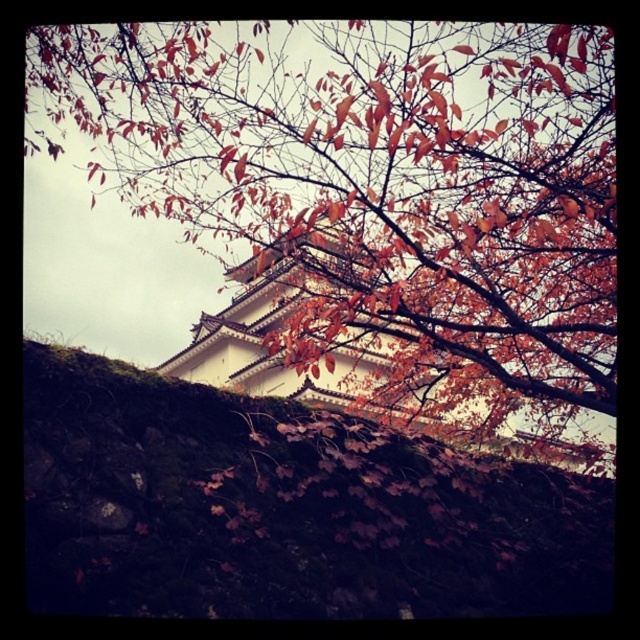
Question: Does autumn leaves at upper center have a greater width compared to mossy stone wall at lower center?

Choices:
 (A) yes
 (B) no

Answer: (A)

Question: Can you confirm if autumn leaves at upper center is smaller than mossy stone wall at lower center?

Choices:
 (A) no
 (B) yes

Answer: (A)

Question: Is autumn leaves at upper center to the right of mossy stone wall at lower center from the viewer's perspective?

Choices:
 (A) no
 (B) yes

Answer: (A)